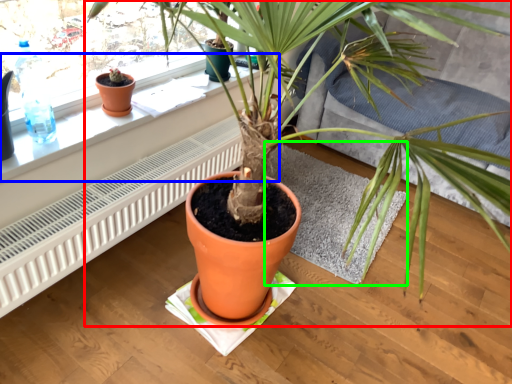
Question: Based on their relative distances, which object is nearer to houseplant (highlighted by a red box)? Choose from window sill (highlighted by a blue box) and wide (highlighted by a green box).

Choices:
 (A) window sill
 (B) wide

Answer: (A)